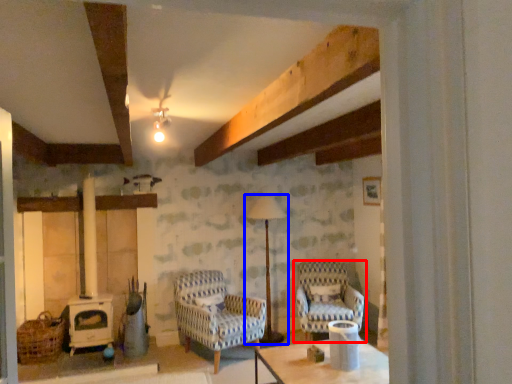
Question: Among these objects, which one is nearest to the camera, chair (highlighted by a red box) or lamp (highlighted by a blue box)?

Choices:
 (A) chair
 (B) lamp

Answer: (A)